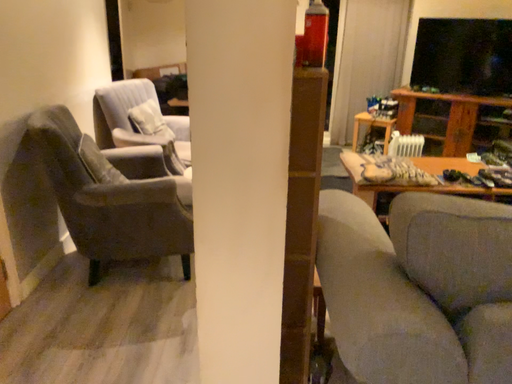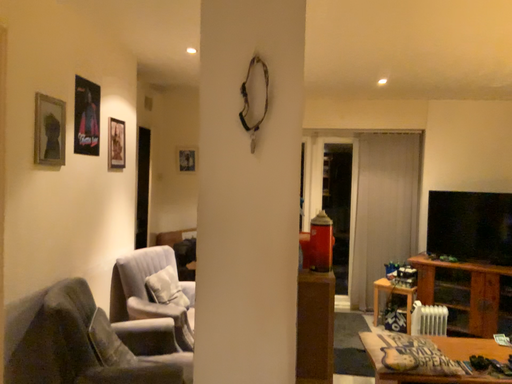
Question: Which way did the camera rotate in the video?

Choices:
 (A) rotated downward
 (B) rotated upward

Answer: (B)